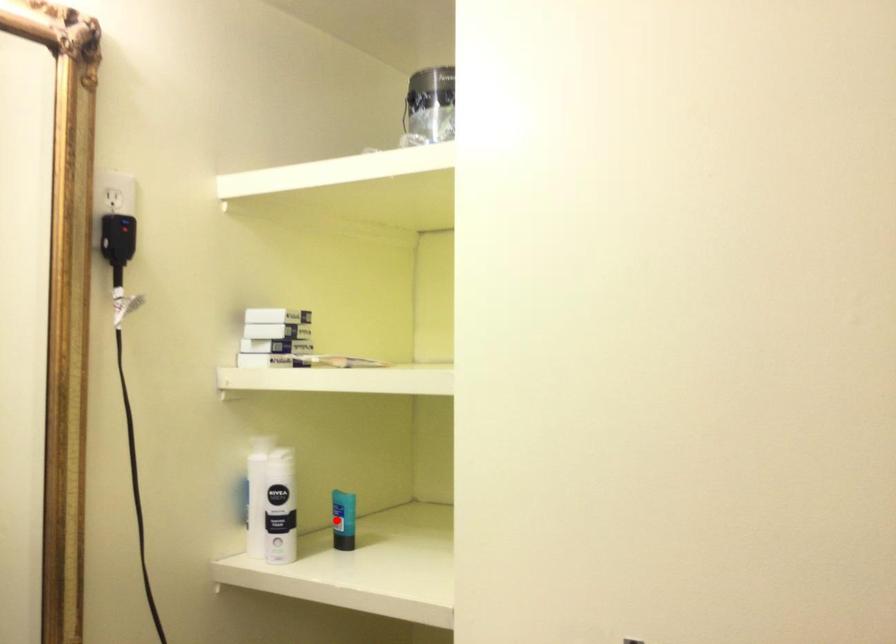
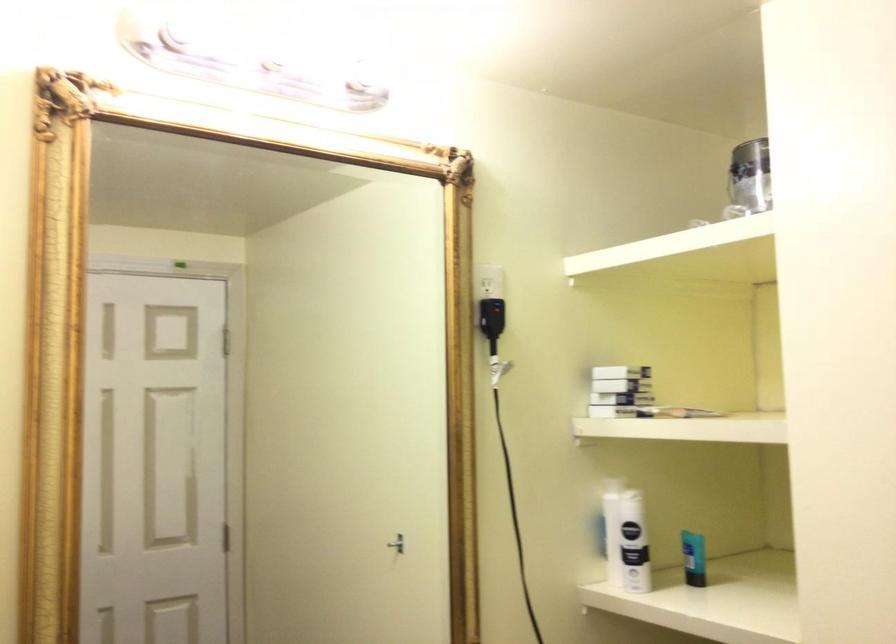
The point at the highlighted location is marked in the first image. Where is the corresponding point in the second image?

(693, 558)